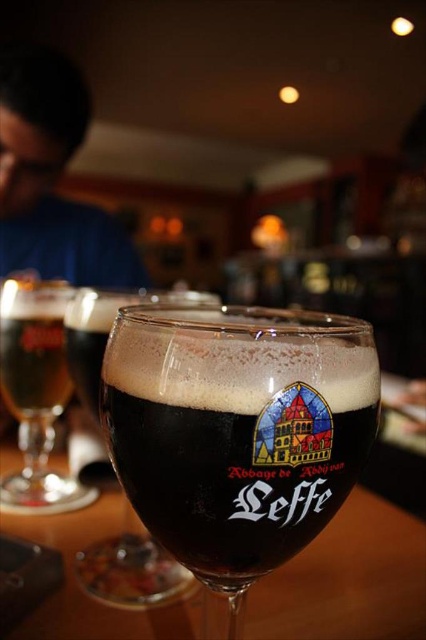
Question: Which point appears farthest from the camera in this image?

Choices:
 (A) (115, 308)
 (B) (48, 432)

Answer: (B)

Question: Is the position of dark glass leffe beer at center more distant than that of translucent amber glass at left?

Choices:
 (A) yes
 (B) no

Answer: (B)

Question: Can you confirm if dark glass leffe beer at center is positioned above blue fabric shirt at upper left?

Choices:
 (A) yes
 (B) no

Answer: (B)

Question: Based on their relative distances, which object is nearer to the dark brown glass at left?

Choices:
 (A) blue fabric shirt at upper left
 (B) translucent amber glass at left
 (C) dark glass leffe beer at center

Answer: (B)

Question: Which of the following is the closest to the observer?

Choices:
 (A) (304, 340)
 (B) (60, 323)

Answer: (A)

Question: Does dark glass leffe beer at center have a larger size compared to dark brown glass at left?

Choices:
 (A) no
 (B) yes

Answer: (B)